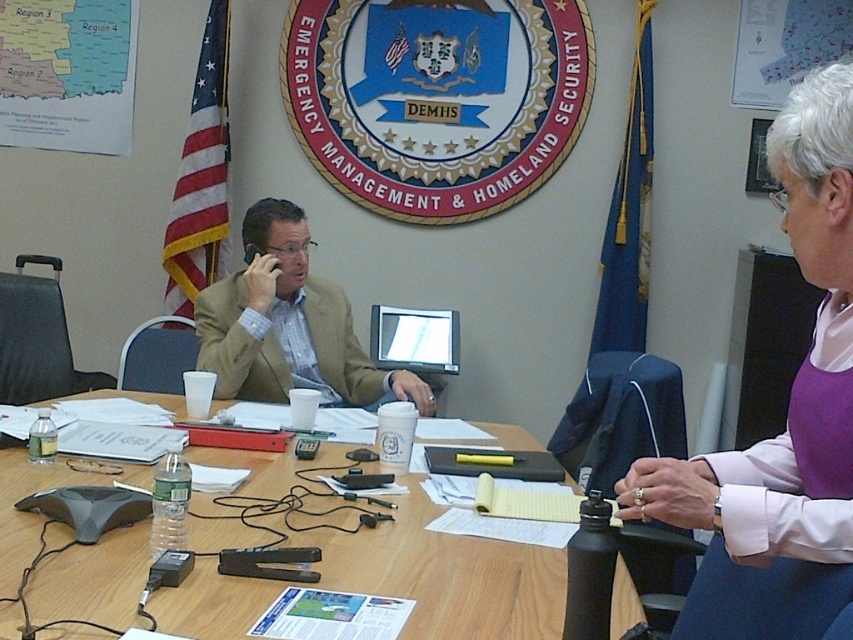
Question: Does wooden table at center have a smaller size compared to purple fabric shirt at upper right?

Choices:
 (A) no
 (B) yes

Answer: (A)

Question: Which point appears farthest from the camera in this image?

Choices:
 (A) (740, 490)
 (B) (285, 378)
 (C) (129, 602)

Answer: (B)

Question: Is purple fabric shirt at upper right bigger than light brown leather jacket at center?

Choices:
 (A) no
 (B) yes

Answer: (A)

Question: Which point is closer to the camera?

Choices:
 (A) (323, 285)
 (B) (248, 460)

Answer: (B)

Question: Can you confirm if purple fabric shirt at upper right is positioned below light brown leather jacket at center?

Choices:
 (A) no
 (B) yes

Answer: (A)

Question: Which point is farther from the camera taking this photo?

Choices:
 (A) (746, 580)
 (B) (469, 552)
 (C) (312, 339)

Answer: (C)